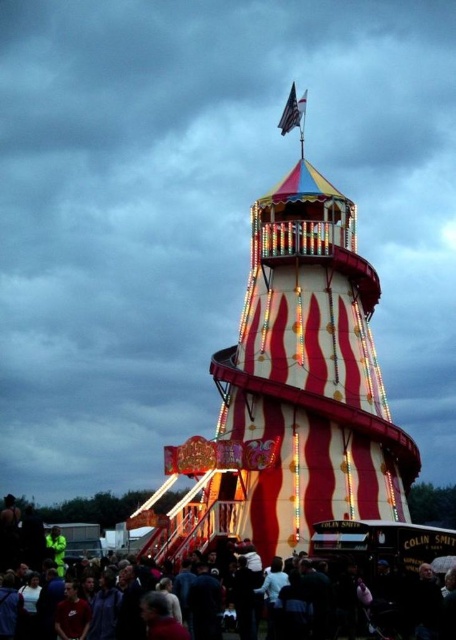
You are a visitor at the fairground and want to take a photo of the white fabric flag at top center. However, there is a dark clothing crowd at lower center in your way. Can you still see the flag through the crowd?

The dark clothing crowd at lower center is closer to the viewer than the white fabric flag at top center, so the crowd is blocking the view of the flag.

You are at a carnival and want to take a photo of the striped fabric tower at center and the white fabric flag at top center. Which object should you focus on first if you want to capture both in one frame without moving the camera?

You should focus on the striped fabric tower at center first because it is taller than the white fabric flag at top center, so it will occupy more space in the frame and ensure both are visible.

You are a performer preparing to enter the striped fabric tower at center. You notice a dark clothing crowd at lower center. Based on the scene, where is the crowd located relative to the tower?

The dark clothing crowd at lower center is behind the striped fabric tower at center, so they are positioned behind the tower.